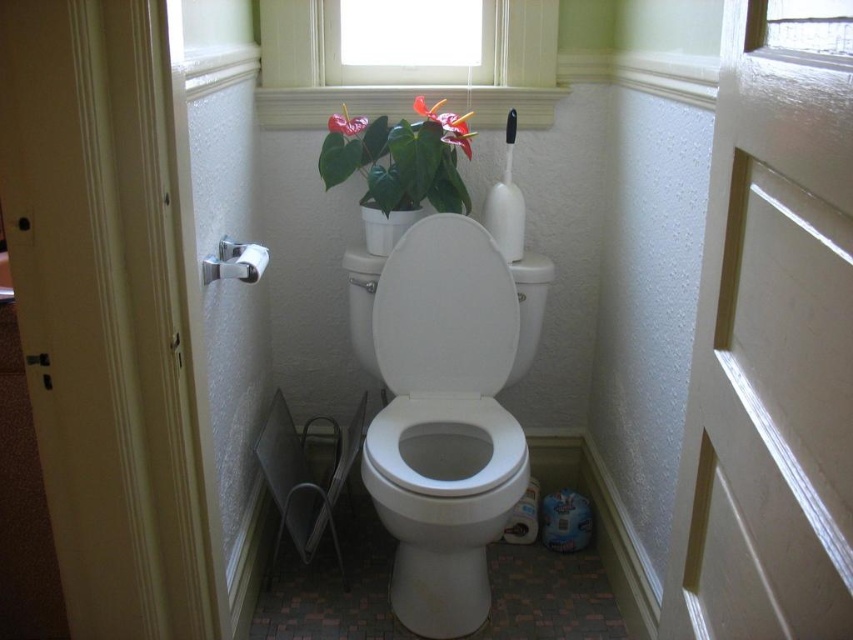
You are standing in the bathroom and want to look out the white textured window at upper center. Which object, the white glossy toilet at center or the window, do you need to move around or past to get a clear view?

The white glossy toilet at center is closer to the viewer than the white textured window at upper center, so you would need to move around or past the white glossy toilet at center to get a clear view of the window.

Based on the photo, you are a guest in this bathroom and need to find the window to let in more light. You see the white glossy toilet at center and the white textured window at upper center. Which object is located higher up in the bathroom?

The white textured window at upper center is located higher up in the bathroom than the white glossy toilet at center.

You are a plumber inspecting the bathroom layout. You see the white glossy toilet bowl at center and the white glossy toilet lid at center. Which one is positioned lower in the image?

The white glossy toilet bowl at center is located below the white glossy toilet lid at center, so it is positioned lower in the image.